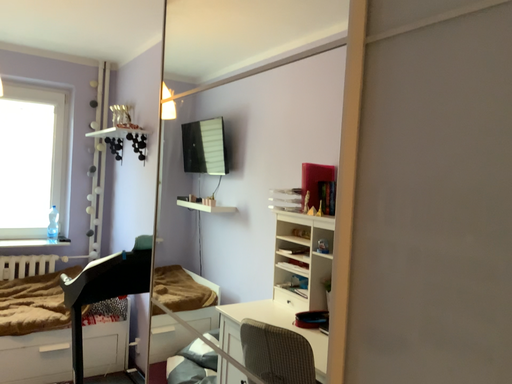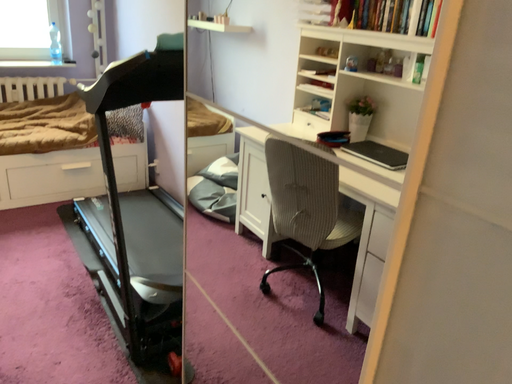
Question: How did the camera likely rotate when shooting the video?

Choices:
 (A) rotated downward
 (B) rotated upward

Answer: (A)